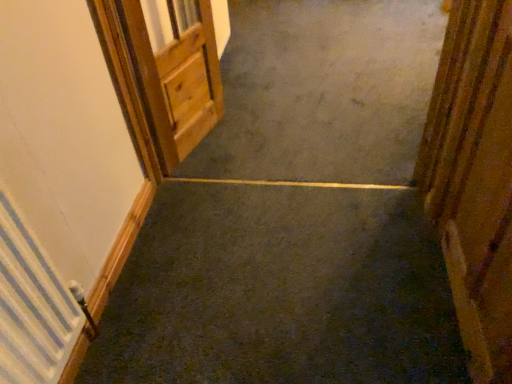
Find the location of `white textured radiator at left`. white textured radiator at left is located at coordinates (32, 306).

Describe the element at coordinates (323, 91) in the screenshot. I see `smooth concrete at center` at that location.

Identify the location of white textured radiator at left. The image size is (512, 384). (32, 306).

Which is closer, [319,84] or [31,314]?

Point [319,84] is farther from the camera than point [31,314].

Which object is closer to the camera, smooth concrete at center or white textured radiator at left?

Positioned in front is white textured radiator at left.

Does smooth concrete at center appear on the right side of white textured radiator at left?

Yes, smooth concrete at center is to the right of white textured radiator at left.

How much distance is there between smooth concrete at center and white textured radiator at left?

smooth concrete at center and white textured radiator at left are 1.48 meters apart.

Between wooden door at upper left, marked as the first door in a back-to-front arrangement, and wooden door at right, the 2th door when ordered from left to right, which one is positioned in front?

wooden door at right, the 2th door when ordered from left to right, is closer to the camera.

From the image's perspective, does wooden door at upper left, arranged as the 1th door when viewed from the left, appear lower than wooden door at right, marked as the first door in a right-to-left arrangement?

Actually, wooden door at upper left, arranged as the 1th door when viewed from the left, appears above wooden door at right, marked as the first door in a right-to-left arrangement, in the image.

The width and height of the screenshot is (512, 384). In order to click on door that appears behind the wooden door at right, the second door in the back-to-front sequence in this screenshot , I will do `click(176, 76)`.

Considering the relative positions of white textured radiator at left and smooth concrete at center in the image provided, is white textured radiator at left to the right of smooth concrete at center from the viewer's perspective?

No.

In the scene shown: Is white textured radiator at left situated inside smooth concrete at center or outside?

white textured radiator at left exists outside the volume of smooth concrete at center.

Is white textured radiator at left taller than smooth concrete at center?

Yes.

Are white textured radiator at left and smooth concrete at center making contact?

No, white textured radiator at left is not in contact with smooth concrete at center.

Considering the relative sizes of smooth concrete at center and wooden door at upper left, placed as the 2th door when sorted from front to back, in the image provided, is smooth concrete at center shorter than wooden door at upper left, placed as the 2th door when sorted from front to back,?

Correct, smooth concrete at center is not as tall as wooden door at upper left, placed as the 2th door when sorted from front to back.

Between smooth concrete at center and wooden door at upper left, marked as the first door in a back-to-front arrangement, which one is positioned in front?

wooden door at upper left, marked as the first door in a back-to-front arrangement, is more forward.

Is smooth concrete at center facing away from wooden door at upper left, marked as the first door in a back-to-front arrangement?

No, smooth concrete at center's orientation is not away from wooden door at upper left, marked as the first door in a back-to-front arrangement.

How much distance is there between smooth concrete at center and wooden door at upper left, the 2th door in the right-to-left sequence?

smooth concrete at center and wooden door at upper left, the 2th door in the right-to-left sequence, are 22.12 inches apart.

Is wooden door at right, the first door when ordered from front to back, not within white textured radiator at left?

Yes, wooden door at right, the first door when ordered from front to back, is outside of white textured radiator at left.

Does wooden door at right, the second door in the back-to-front sequence, have a greater height compared to white textured radiator at left?

Correct, wooden door at right, the second door in the back-to-front sequence, is much taller as white textured radiator at left.

Is point (483, 319) farther from camera compared to point (20, 340)?

Yes, it is.

From a real-world perspective, is wooden door at right, the second door in the back-to-front sequence, beneath white textured radiator at left?

No, from a real-world perspective, wooden door at right, the second door in the back-to-front sequence, is not below white textured radiator at left.

Is wooden door at upper left, the 2th door in the right-to-left sequence, oriented towards white textured radiator at left?

No, wooden door at upper left, the 2th door in the right-to-left sequence, is not turned towards white textured radiator at left.

Is wooden door at upper left, the 2th door in the right-to-left sequence, to the left of white textured radiator at left from the viewer's perspective?

In fact, wooden door at upper left, the 2th door in the right-to-left sequence, is to the right of white textured radiator at left.

Does wooden door at upper left, marked as the first door in a back-to-front arrangement, lie in front of white textured radiator at left?

No.

Is wooden door at upper left, arranged as the 1th door when viewed from the left, surrounding smooth concrete at center?

No, smooth concrete at center is not inside wooden door at upper left, arranged as the 1th door when viewed from the left.

Considering the relative positions of wooden door at upper left, the 2th door in the right-to-left sequence, and smooth concrete at center in the image provided, is wooden door at upper left, the 2th door in the right-to-left sequence, to the left of smooth concrete at center from the viewer's perspective?

Yes, wooden door at upper left, the 2th door in the right-to-left sequence, is to the left of smooth concrete at center.

Considering the sizes of objects wooden door at upper left, arranged as the 1th door when viewed from the left, and smooth concrete at center in the image provided, who is shorter, wooden door at upper left, arranged as the 1th door when viewed from the left, or smooth concrete at center?

Standing shorter between the two is smooth concrete at center.

Is there a large distance between wooden door at upper left, placed as the 2th door when sorted from front to back, and smooth concrete at center?

No, wooden door at upper left, placed as the 2th door when sorted from front to back, is not far away from smooth concrete at center.

Where is `radiator in front of the smooth concrete at center`? radiator in front of the smooth concrete at center is located at coordinates (32, 306).

In the image, there is a wooden door at right, the first door when ordered from front to back. Identify the location of door above it (from the image's perspective). The width and height of the screenshot is (512, 384). tap(176, 76).

Looking at the image, which one is located further to wooden door at upper left, arranged as the 1th door when viewed from the left, smooth concrete at center or wooden door at right, the second door in the back-to-front sequence?

wooden door at right, the second door in the back-to-front sequence, is positioned further to the anchor wooden door at upper left, arranged as the 1th door when viewed from the left.

Consider the image. Estimate the real-world distances between objects in this image. Which object is further from wooden door at upper left, the 2th door in the right-to-left sequence, wooden door at right, the second door in the back-to-front sequence, or smooth concrete at center?

wooden door at right, the second door in the back-to-front sequence, is positioned further to the anchor wooden door at upper left, the 2th door in the right-to-left sequence.

Which object lies further to the anchor point wooden door at upper left, the 2th door in the right-to-left sequence, white textured radiator at left or smooth concrete at center?

The object further to wooden door at upper left, the 2th door in the right-to-left sequence, is white textured radiator at left.

From the picture: Looking at the image, which one is located closer to smooth concrete at center, white textured radiator at left or wooden door at right, the second door in the back-to-front sequence?

wooden door at right, the second door in the back-to-front sequence.

From the picture: Estimate the real-world distances between objects in this image. Which object is closer to smooth concrete at center, wooden door at right, the 2th door when ordered from left to right, or wooden door at upper left, placed as the 2th door when sorted from front to back?

wooden door at upper left, placed as the 2th door when sorted from front to back, lies closer to smooth concrete at center than the other object.

Based on their spatial positions, is white textured radiator at left or wooden door at right, the second door in the back-to-front sequence, further from wooden door at upper left, placed as the 2th door when sorted from front to back?

Based on the image, wooden door at right, the second door in the back-to-front sequence, appears to be further to wooden door at upper left, placed as the 2th door when sorted from front to back.

Based on their spatial positions, is smooth concrete at center or wooden door at right, the first door when ordered from front to back, closer to white textured radiator at left?

Among the two, wooden door at right, the first door when ordered from front to back, is located nearer to white textured radiator at left.

Based on their spatial positions, is smooth concrete at center or wooden door at upper left, marked as the first door in a back-to-front arrangement, further from white textured radiator at left?

smooth concrete at center.

Find the location of a particular element. This screenshot has height=384, width=512. radiator positioned between wooden door at right, the 2th door when ordered from left to right, and smooth concrete at center from near to far is located at coordinates (32, 306).

Image resolution: width=512 pixels, height=384 pixels. I want to click on door between white textured radiator at left and wooden door at right, the 2th door when ordered from left to right, so click(176, 76).

Where is `door located between wooden door at right, marked as the first door in a right-to-left arrangement, and smooth concrete at center in the depth direction`? door located between wooden door at right, marked as the first door in a right-to-left arrangement, and smooth concrete at center in the depth direction is located at coordinates (176, 76).